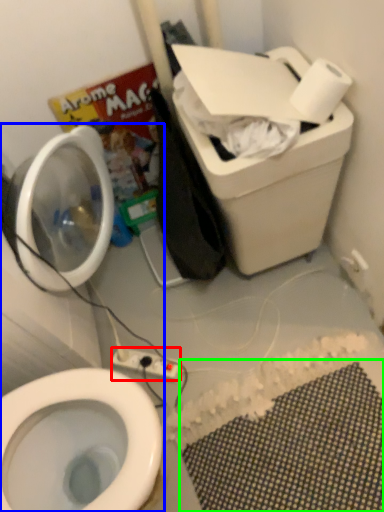
Question: Based on their relative distances, which object is nearer to electric outlet (highlighted by a red box)? Choose from toiletries (highlighted by a blue box) and bath mat (highlighted by a green box).

Choices:
 (A) toiletries
 (B) bath mat

Answer: (B)